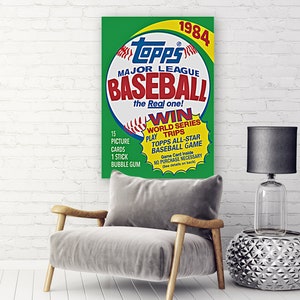
The image size is (300, 300). Find the location of `wall`. wall is located at coordinates (65, 128).